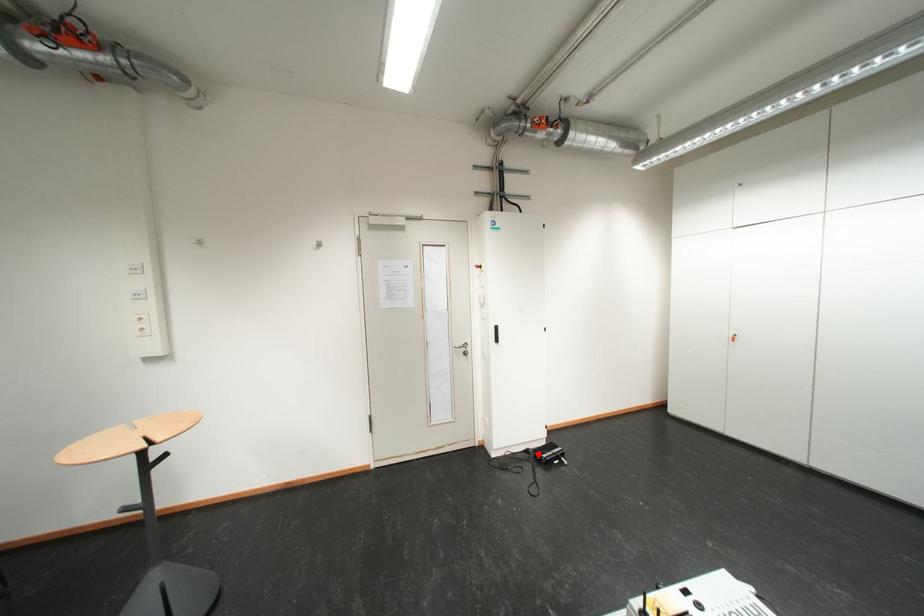
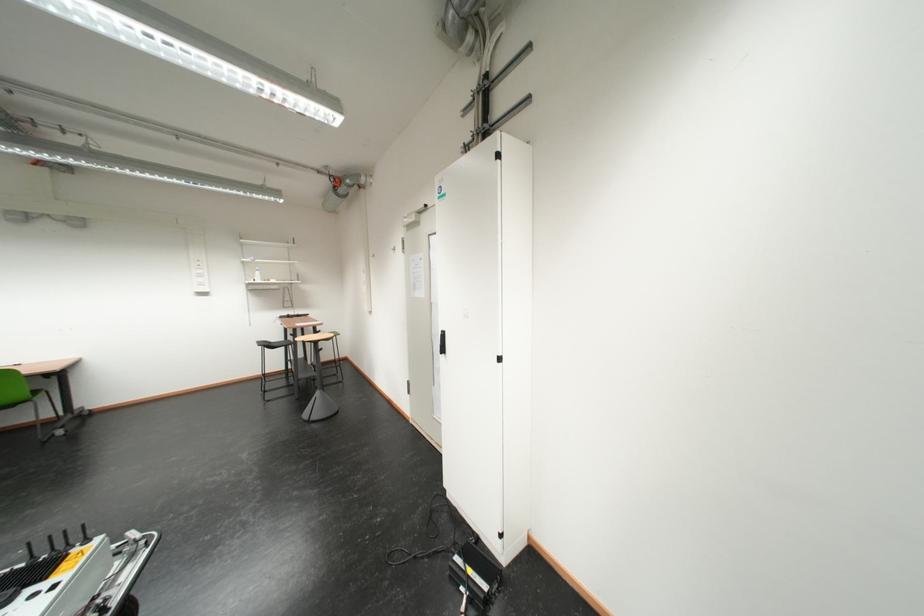
Question: I am providing you with two images of the same scene from different viewpoints. A red point is marked on the first image. At the location where the point appears in image 1, is it still visible in image 2?

Choices:
 (A) Yes
 (B) No

Answer: (B)